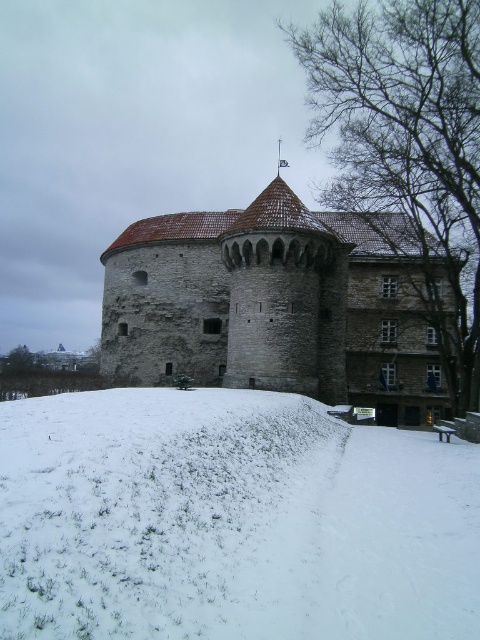
Is white fluffy snow at lower center smaller than stone tower at center?

Yes, white fluffy snow at lower center is smaller than stone tower at center.

Locate an element on the screen. Image resolution: width=480 pixels, height=640 pixels. white fluffy snow at lower center is located at coordinates (230, 522).

Does point (304, 604) come farther from viewer compared to point (279, 224)?

No, (304, 604) is in front of (279, 224).

You are a GUI agent. You are given a task and a screenshot of the screen. Output one action in this format:
    pyautogui.click(x=<x>, y=<y>)
    Task: Click on the white fluffy snow at lower center
    The image size is (480, 640).
    Given the screenshot: What is the action you would take?
    pyautogui.click(x=230, y=522)